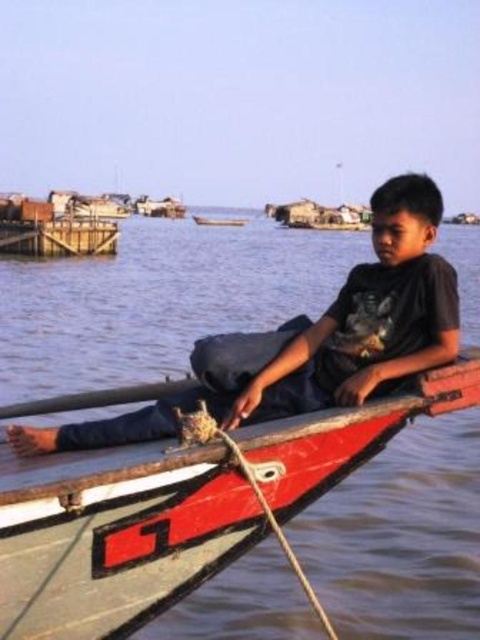
You are a visitor who wants to board the wooden canoe at center and the smooth wood boat at center. Which one is closer to your current position if you are standing on the dock to the left of both vessels?

The smooth wood boat at center is closer to your current position because it is positioned to the left of the wooden canoe at center, and since you are on the dock to the left of both, the smooth wood boat at center would be nearer.

You are planning to row the wooden canoe at center while wearing the matte black shirt at center. Considering the width of the canoe, will your shirt fit comfortably without getting caught on the sides?

The wooden canoe at center has a lesser width compared to matte black shirt at center, so the shirt may not fit comfortably as the canoe is narrower than the shirt.

You are a photographer trying to capture the boy in the scene. Since you want to focus on his clothing, which object should you zoom in on more closely between the matte black shirt at center and the smooth wood boat at center?

The matte black shirt at center is shorter than the smooth wood boat at center, so you should zoom in more on the matte black shirt at center to focus on his clothing.